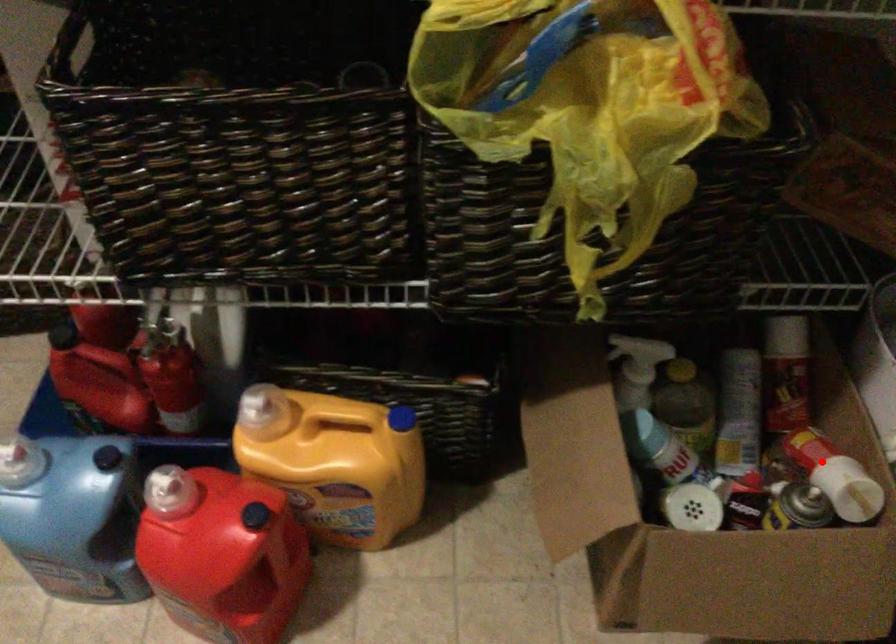
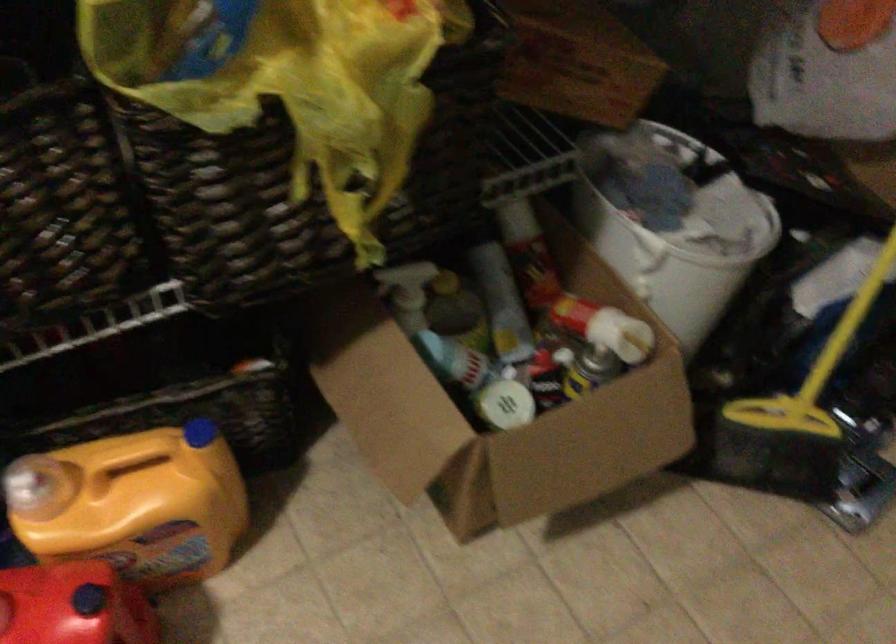
The point at the highlighted location is marked in the first image. Where is the corresponding point in the second image?

(595, 319)